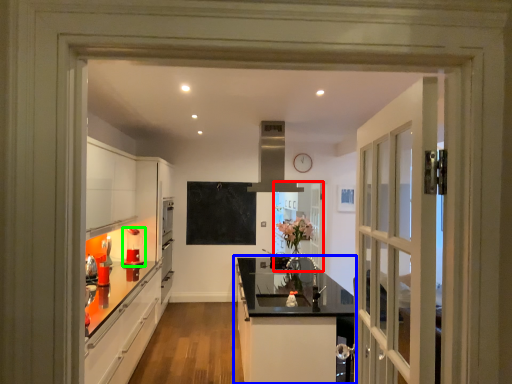
Question: Based on their relative distances, which object is nearer to door (highlighted by a red box)? Choose from cabinetry (highlighted by a blue box) and appliance (highlighted by a green box).

Choices:
 (A) cabinetry
 (B) appliance

Answer: (A)